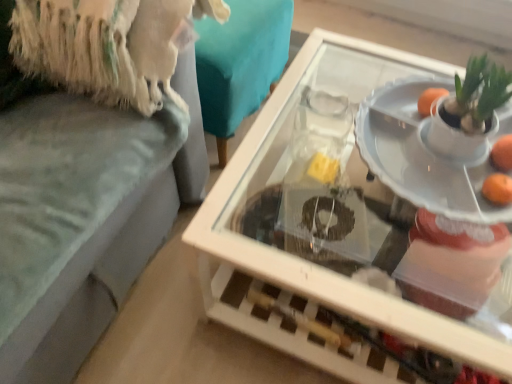
Question: Is point (287, 158) closer or farther from the camera than point (487, 190)?

Choices:
 (A) farther
 (B) closer

Answer: (A)

Question: Based on their sizes in the image, would you say transparent glass table at center is bigger or smaller than orange matte at right, placed as the 2th orange when sorted from top to bottom?

Choices:
 (A) big
 (B) small

Answer: (A)

Question: Estimate the real-world distances between objects in this image. Which object is closer to the orange matte at right, the 1th orange positioned from the bottom?

Choices:
 (A) white glossy plate at center
 (B) transparent glass table at center
 (C) orange matte at right, which is the second orange from bottom to top

Answer: (C)

Question: Which object is positioned farthest from the orange matte at right, the second orange in the front-to-back sequence?

Choices:
 (A) transparent glass table at center
 (B) orange matte at right, which appears as the first orange when viewed from the front
 (C) white glossy plate at center

Answer: (A)